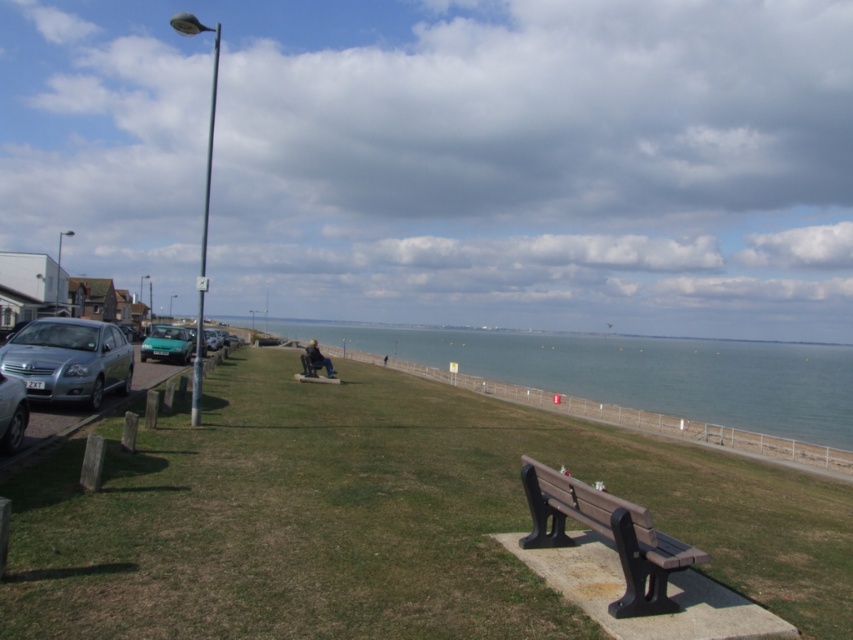
Who is more distant from viewer, (x=480, y=353) or (x=86, y=330)?

The point (x=480, y=353) is more distant.

The height and width of the screenshot is (640, 853). In order to click on blue water at center in this screenshot , I will do `click(643, 380)`.

Can you confirm if brown wood bench at lower right is taller than green matte car at left?

No, brown wood bench at lower right is not taller than green matte car at left.

Is point (619, 611) positioned after point (183, 346)?

No, it is in front of (183, 346).

Locate an element on the screen. brown wood bench at lower right is located at coordinates (607, 536).

The image size is (853, 640). Describe the element at coordinates (607, 536) in the screenshot. I see `brown wood bench at lower right` at that location.

Is brown wood bench at lower right bigger than satin silver car at left?

Incorrect, brown wood bench at lower right is not larger than satin silver car at left.

The height and width of the screenshot is (640, 853). In order to click on brown wood bench at lower right in this screenshot , I will do `click(607, 536)`.